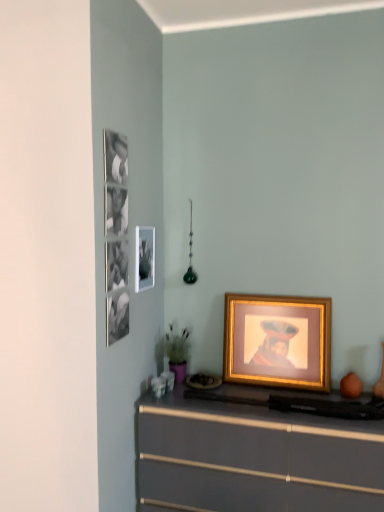
Question: Is gold metallic picture frame at center, the 1th picture frame positioned from the bottom, oriented away from matte gray chest of drawers at lower center?

Choices:
 (A) no
 (B) yes

Answer: (A)

Question: Is the depth of gold metallic picture frame at center, the first picture frame when ordered from right to left, less than that of matte gray chest of drawers at lower center?

Choices:
 (A) yes
 (B) no

Answer: (B)

Question: Does gold metallic picture frame at center, the 1th picture frame positioned from the bottom, have a greater height compared to matte gray chest of drawers at lower center?

Choices:
 (A) no
 (B) yes

Answer: (A)

Question: Is gold metallic picture frame at center, the first picture frame when ordered from right to left, thinner than matte gray chest of drawers at lower center?

Choices:
 (A) yes
 (B) no

Answer: (A)

Question: Is gold metallic picture frame at center, the 1th picture frame positioned from the bottom, not within matte gray chest of drawers at lower center?

Choices:
 (A) yes
 (B) no

Answer: (A)

Question: In terms of width, does gold metallic picture frame at center, which is counted as the second picture frame, starting from the top, look wider or thinner when compared to metallic silver picture frame at upper left, acting as the first picture frame starting from the left?

Choices:
 (A) wide
 (B) thin

Answer: (A)

Question: From the image's perspective, is gold metallic picture frame at center, the 1th picture frame positioned from the bottom, above or below metallic silver picture frame at upper left, arranged as the second picture frame when viewed from the right?

Choices:
 (A) below
 (B) above

Answer: (A)

Question: Would you say gold metallic picture frame at center, placed as the second picture frame when sorted from left to right, is to the left or to the right of metallic silver picture frame at upper left, the second picture frame from the bottom, in the picture?

Choices:
 (A) right
 (B) left

Answer: (A)

Question: Considering the positions of gold metallic picture frame at center, placed as the second picture frame when sorted from left to right, and metallic silver picture frame at upper left, the second picture frame from the bottom, in the image, is gold metallic picture frame at center, placed as the second picture frame when sorted from left to right, bigger or smaller than metallic silver picture frame at upper left, the second picture frame from the bottom,?

Choices:
 (A) big
 (B) small

Answer: (A)

Question: Do you think metallic silver picture frame at upper left, arranged as the second picture frame when viewed from the right, is within matte gray chest of drawers at lower center, or outside of it?

Choices:
 (A) outside
 (B) inside

Answer: (A)

Question: From a real-world perspective, relative to matte gray chest of drawers at lower center, is metallic silver picture frame at upper left, the second picture frame from the bottom, vertically above or below?

Choices:
 (A) below
 (B) above

Answer: (B)

Question: In the image, is metallic silver picture frame at upper left, arranged as the second picture frame when viewed from the right, on the left side or the right side of matte gray chest of drawers at lower center?

Choices:
 (A) right
 (B) left

Answer: (B)

Question: From their relative heights in the image, would you say metallic silver picture frame at upper left, arranged as the second picture frame when viewed from the right, is taller or shorter than matte gray chest of drawers at lower center?

Choices:
 (A) short
 (B) tall

Answer: (A)

Question: Visually, is metallic silver picture frame at upper left, arranged as the second picture frame when viewed from the right, positioned to the left or to the right of gold metallic picture frame at center, placed as the second picture frame when sorted from left to right?

Choices:
 (A) right
 (B) left

Answer: (B)

Question: Is point (148, 244) closer or farther from the camera than point (243, 336)?

Choices:
 (A) closer
 (B) farther

Answer: (A)